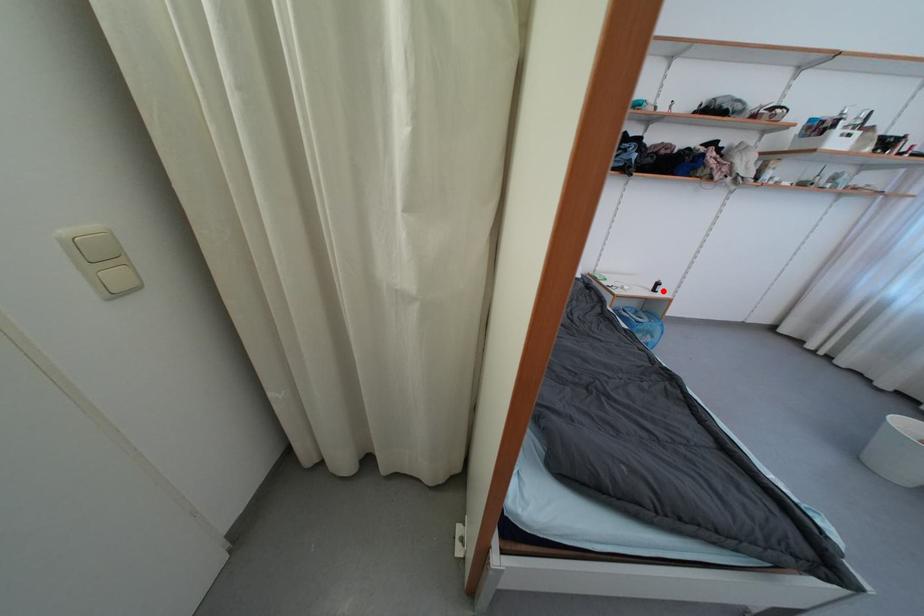
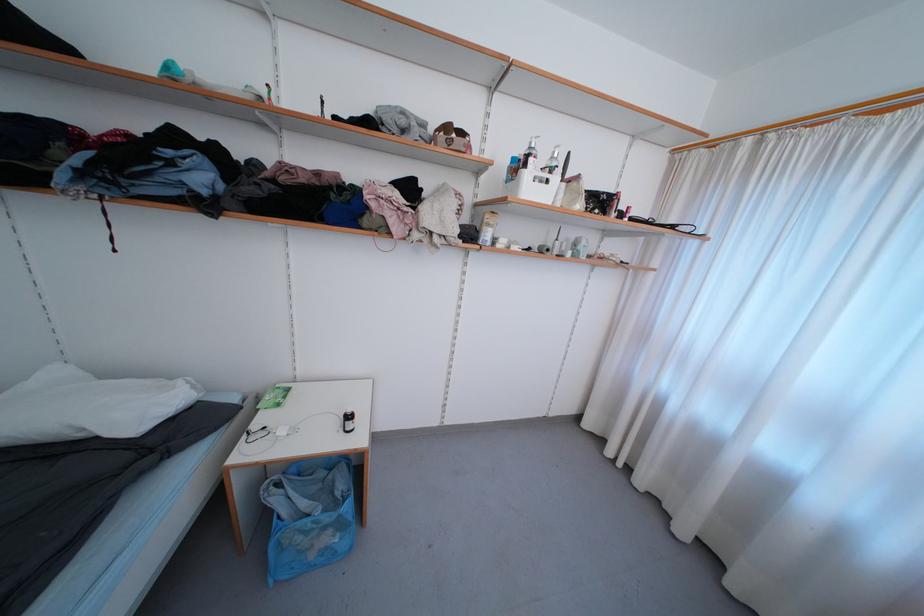
Find the pixel in the second image that matches the highlighted location in the first image.

(354, 429)